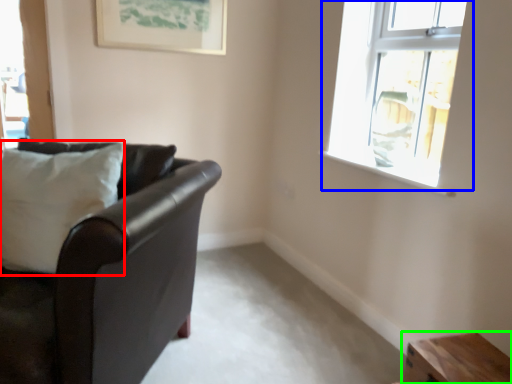
Question: Estimate the real-world distances between objects in this image. Which object is closer to pillow (highlighted by a red box), window (highlighted by a blue box) or table (highlighted by a green box)?

Choices:
 (A) window
 (B) table

Answer: (B)